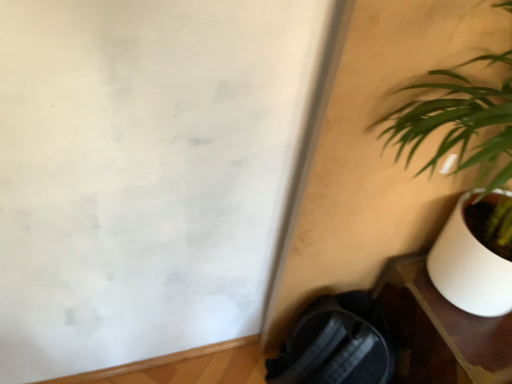
Question: Would you say green leafy plant at right is to the left or to the right of white glossy table at lower right in the picture?

Choices:
 (A) left
 (B) right

Answer: (A)

Question: Considering their positions, is green leafy plant at right located in front of or behind white glossy table at lower right?

Choices:
 (A) front
 (B) behind

Answer: (A)

Question: From the image's perspective, is green leafy plant at right located above or below white glossy table at lower right?

Choices:
 (A) above
 (B) below

Answer: (A)

Question: In terms of width, does white glossy table at lower right look wider or thinner when compared to green leafy plant at right?

Choices:
 (A) thin
 (B) wide

Answer: (B)

Question: From a real-world perspective, is white glossy table at lower right above or below green leafy plant at right?

Choices:
 (A) above
 (B) below

Answer: (B)

Question: In terms of size, does white glossy table at lower right appear bigger or smaller than green leafy plant at right?

Choices:
 (A) small
 (B) big

Answer: (B)

Question: Considering the positions of white glossy table at lower right and green leafy plant at right in the image, is white glossy table at lower right taller or shorter than green leafy plant at right?

Choices:
 (A) tall
 (B) short

Answer: (B)